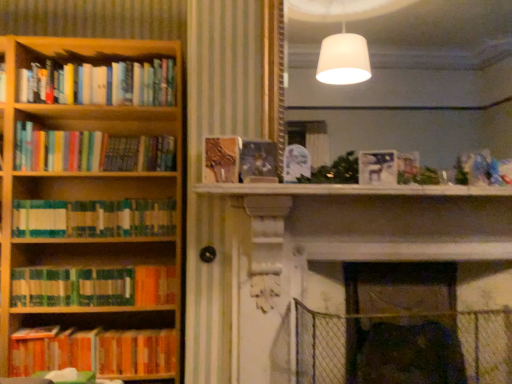
Question: From a real-world perspective, does hardcover books at left, which is the 1th book in top-to-bottom order, stand above wooden bookcase at left?

Choices:
 (A) no
 (B) yes

Answer: (B)

Question: Could wooden bookcase at left be considered to be inside hardcover books at left, which is the 1th book in top-to-bottom order?

Choices:
 (A) no
 (B) yes

Answer: (A)

Question: Is hardcover books at left, which is the 1th book in top-to-bottom order, smaller than wooden bookcase at left?

Choices:
 (A) yes
 (B) no

Answer: (A)

Question: Is hardcover books at left, which is the 1th book in top-to-bottom order, looking in the opposite direction of wooden bookcase at left?

Choices:
 (A) yes
 (B) no

Answer: (A)

Question: Can you confirm if hardcover books at left, which ranks as the 6th book in bottom-to-top order, is positioned to the left of wooden bookcase at left?

Choices:
 (A) no
 (B) yes

Answer: (A)

Question: Considering the relative positions of hardcover books at left, which is the 1th book in top-to-bottom order, and wooden bookcase at left in the image provided, is hardcover books at left, which is the 1th book in top-to-bottom order, to the right of wooden bookcase at left from the viewer's perspective?

Choices:
 (A) yes
 (B) no

Answer: (A)

Question: Would you say wooden bookcase at left is outside green matte bookshelf at left, which is the 4th book in top-to-bottom order?

Choices:
 (A) yes
 (B) no

Answer: (A)

Question: From the image's perspective, would you say wooden bookcase at left is positioned over green matte bookshelf at left, which is the 4th book in top-to-bottom order?

Choices:
 (A) yes
 (B) no

Answer: (B)

Question: Is wooden bookcase at left not near green matte bookshelf at left, which is the 4th book in top-to-bottom order?

Choices:
 (A) yes
 (B) no

Answer: (B)

Question: Can you confirm if wooden bookcase at left is positioned to the right of green matte bookshelf at left, the 3th book ordered from the bottom?

Choices:
 (A) no
 (B) yes

Answer: (A)

Question: Is wooden bookcase at left oriented away from green matte bookshelf at left, the 3th book ordered from the bottom?

Choices:
 (A) no
 (B) yes

Answer: (B)

Question: Does wooden bookcase at left have a greater width compared to green matte bookshelf at left, the 3th book ordered from the bottom?

Choices:
 (A) no
 (B) yes

Answer: (B)

Question: Is hardcover books at left, which ranks as the 6th book in bottom-to-top order, at the back of velvet dark brown swivel chair at lower right?

Choices:
 (A) no
 (B) yes

Answer: (A)